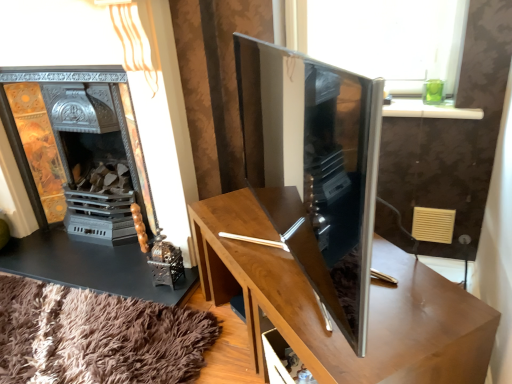
Question: From the image's perspective, is metallic ornate fireplace at left beneath wooden table at center?

Choices:
 (A) no
 (B) yes

Answer: (A)

Question: Can you confirm if metallic ornate fireplace at left is thinner than wooden table at center?

Choices:
 (A) yes
 (B) no

Answer: (A)

Question: Can you confirm if metallic ornate fireplace at left is bigger than wooden table at center?

Choices:
 (A) yes
 (B) no

Answer: (A)

Question: Is metallic ornate fireplace at left directly adjacent to wooden table at center?

Choices:
 (A) no
 (B) yes

Answer: (A)

Question: From a real-world perspective, is metallic ornate fireplace at left located higher than wooden table at center?

Choices:
 (A) yes
 (B) no

Answer: (A)

Question: Can you confirm if metallic ornate fireplace at left is smaller than wooden table at center?

Choices:
 (A) yes
 (B) no

Answer: (B)

Question: Is satin wood tv cabinet at center to the left of metallic ornate fireplace at left from the viewer's perspective?

Choices:
 (A) yes
 (B) no

Answer: (B)

Question: Is satin wood tv cabinet at center shorter than metallic ornate fireplace at left?

Choices:
 (A) no
 (B) yes

Answer: (B)

Question: Is satin wood tv cabinet at center behind metallic ornate fireplace at left?

Choices:
 (A) no
 (B) yes

Answer: (A)

Question: Can metallic ornate fireplace at left be found inside satin wood tv cabinet at center?

Choices:
 (A) yes
 (B) no

Answer: (B)

Question: From the image's perspective, is satin wood tv cabinet at center located above metallic ornate fireplace at left?

Choices:
 (A) no
 (B) yes

Answer: (A)

Question: Does satin wood tv cabinet at center have a greater height compared to metallic ornate fireplace at left?

Choices:
 (A) no
 (B) yes

Answer: (A)

Question: Can you confirm if satin wood tv cabinet at center is shorter than wooden table at center?

Choices:
 (A) no
 (B) yes

Answer: (A)